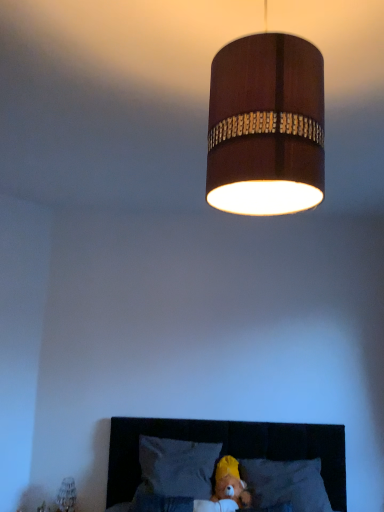
Question: Considering the positions of velvet dark brown headboard at lower center and wooden lampshade at upper center in the image, is velvet dark brown headboard at lower center wider or thinner than wooden lampshade at upper center?

Choices:
 (A) thin
 (B) wide

Answer: (B)

Question: Considering the positions of velvet dark brown headboard at lower center and wooden lampshade at upper center in the image, is velvet dark brown headboard at lower center bigger or smaller than wooden lampshade at upper center?

Choices:
 (A) big
 (B) small

Answer: (A)

Question: Which of these objects is positioned closest to the yellow plush at lower center?

Choices:
 (A) gray fabric pillow at lower center, the 2th pillow viewed from the left
 (B) velvet dark brown headboard at lower center
 (C) wooden cylinder at upper center
 (D) wooden lampshade at upper center
 (E) dark gray fabric pillow at lower center, which is counted as the first pillow, starting from the left

Answer: (A)

Question: Which object is positioned closest to the wooden cylinder at upper center?

Choices:
 (A) gray fabric pillow at lower center, the 2th pillow viewed from the left
 (B) yellow plush at lower center
 (C) velvet dark brown headboard at lower center
 (D) dark gray fabric pillow at lower center, acting as the 2th pillow starting from the right
 (E) wooden lampshade at upper center

Answer: (D)